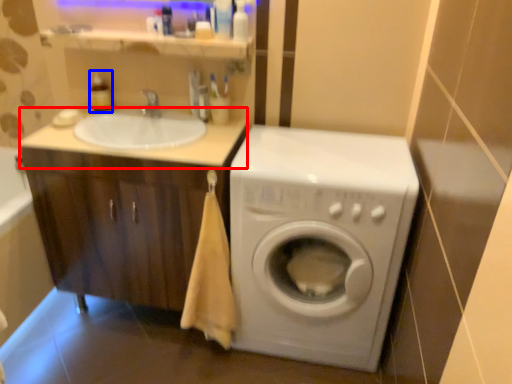
Question: Which object appears farthest to the camera in this image, counter top (highlighted by a red box) or toiletry (highlighted by a blue box)?

Choices:
 (A) counter top
 (B) toiletry

Answer: (B)